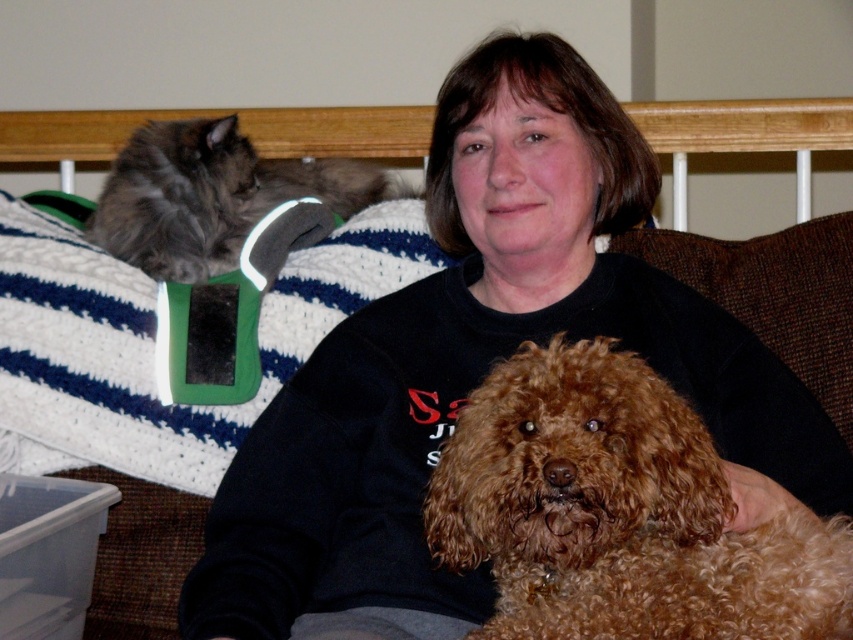
Who is more forward, (x=709, y=472) or (x=293, y=193)?

Point (x=709, y=472) is in front.

Is brown curly fur dog at center to the left of gray fluffy cat at upper left from the viewer's perspective?

Incorrect, brown curly fur dog at center is not on the left side of gray fluffy cat at upper left.

At what (x,y) coordinates should I click in order to perform the action: click on brown curly fur dog at center. Please return your answer as a coordinate pair (x, y). Looking at the image, I should click on (618, 513).